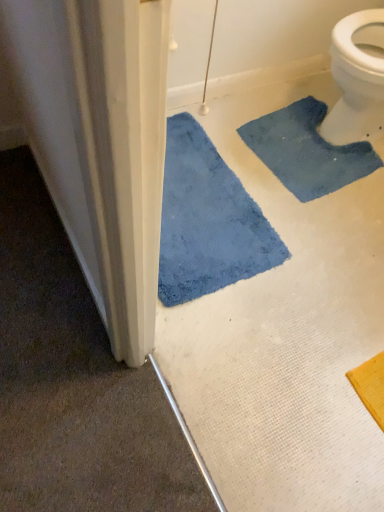
The width and height of the screenshot is (384, 512). I want to click on free space in front of blue fuzzy bath mat at upper right, the second bath mat in the left-to-right sequence, so click(x=315, y=234).